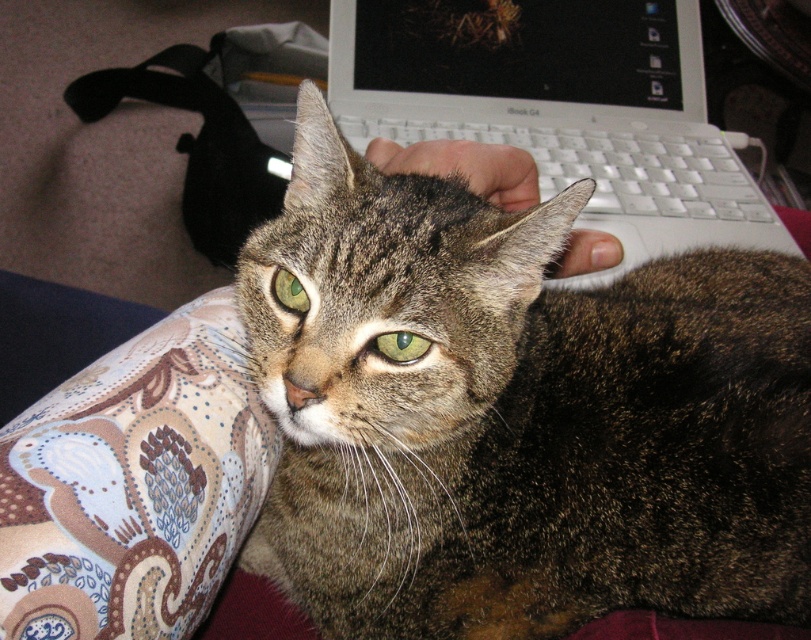
You are a photographer trying to capture the cat in the image. You want to ensure both green matte eye at center and green glossy eye at center are clearly visible in the photo. Based on their positions, which eye might be closer to the camera?

The green glossy eye at center is taller than the green matte eye at center, so it is likely closer to the camera.

You are sitting in a chair and want to reach the point marked at coordinates (771,220). Your arm can extend 3 feet. Can you reach it?

The point marked at coordinates (771,220) is 4.06 feet away from you, so you cannot reach it with an arm extension of 3 feet.